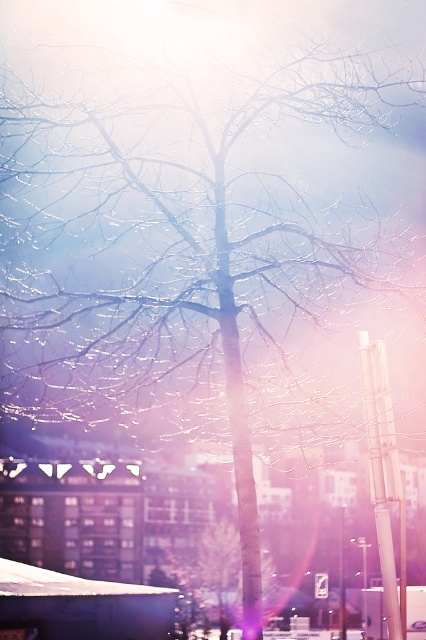
You are a city planner analyzing the urban space. The white glossy pole at right and the smooth bark tree at center are both in the foreground. Which object takes up more visual space in the image?

The smooth bark tree at center occupies more visual space than the white glossy pole at right.